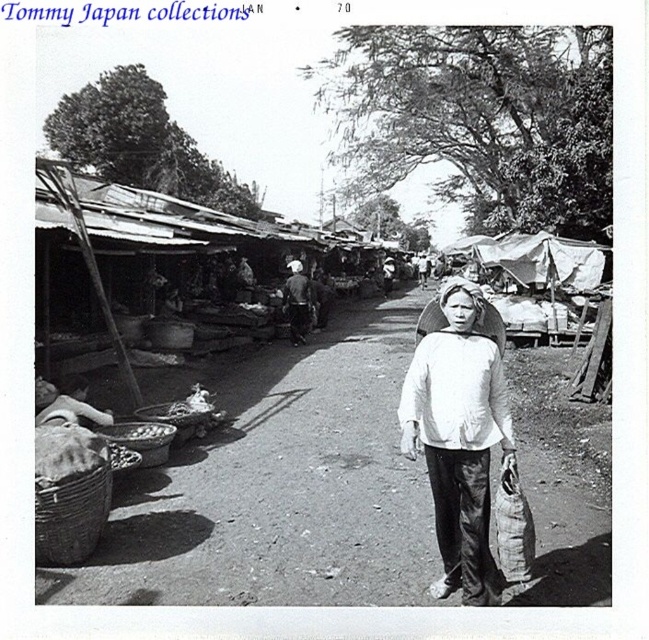
You are a customer at the market and see both the white fabric bag at center and the white cotton shirt at center. If you are facing the stalls, which item is positioned to your right?

The white fabric bag at center is to the right of the white cotton shirt at center, so when facing the stalls, the white fabric bag at center would be on your right side.

You are a customer at the market and see both the white fabric bag at center and the dark gray fabric bag at center. Which bag is shorter in height?

The white fabric bag at center is not as tall as the dark gray fabric bag at center, so the white fabric bag at center is shorter in height.

Based on the scene description, where is the white cotton shirt at center located in the image?

The white cotton shirt at center is located at the 2D coordinates point (459, 435) in the image.